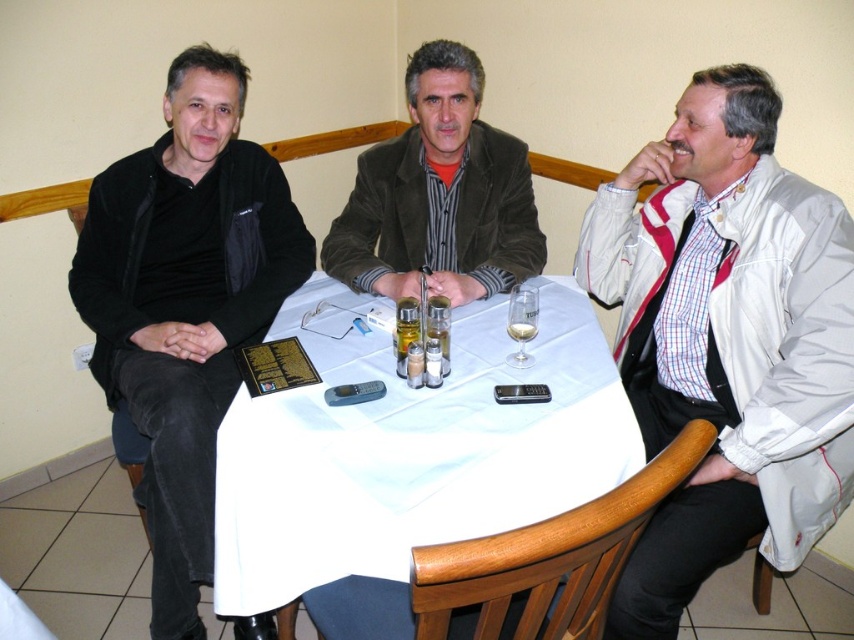
Question: Is white leather jacket at right positioned behind black matte jacket at left?

Choices:
 (A) yes
 (B) no

Answer: (B)

Question: Which object appears farthest from the camera in this image?

Choices:
 (A) white cloth at center
 (B) velvet brown jacket at center

Answer: (B)

Question: Estimate the real-world distances between objects in this image. Which object is closer to the velvet brown jacket at center?

Choices:
 (A) white leather jacket at right
 (B) black matte jacket at left
 (C) white cloth at center

Answer: (C)

Question: Observing the image, what is the correct spatial positioning of white leather jacket at right in reference to black matte jacket at left?

Choices:
 (A) below
 (B) above

Answer: (A)

Question: In this image, where is black matte jacket at left located relative to velvet brown jacket at center?

Choices:
 (A) right
 (B) left

Answer: (B)

Question: Which of these objects is positioned farthest from the black matte jacket at left?

Choices:
 (A) velvet brown jacket at center
 (B) white leather jacket at right

Answer: (B)